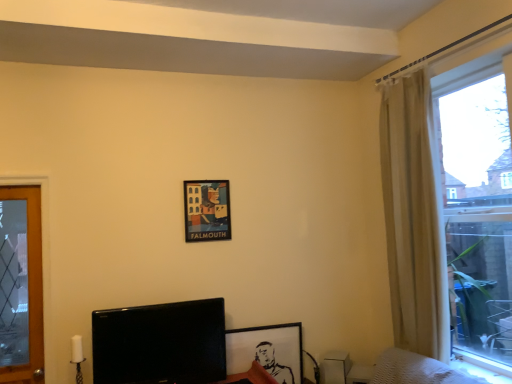
Question: Would you say black glossy tv at lower left is a long distance from beige fabric curtain at right?

Choices:
 (A) yes
 (B) no

Answer: (A)

Question: Does black glossy tv at lower left have a larger size compared to beige fabric curtain at right?

Choices:
 (A) yes
 (B) no

Answer: (B)

Question: Is black glossy tv at lower left next to beige fabric curtain at right?

Choices:
 (A) yes
 (B) no

Answer: (B)

Question: Does black glossy tv at lower left appear on the left side of beige fabric curtain at right?

Choices:
 (A) no
 (B) yes

Answer: (B)

Question: Is black glossy tv at lower left taller than beige fabric curtain at right?

Choices:
 (A) yes
 (B) no

Answer: (B)

Question: From a real-world perspective, is black glossy tv at lower left under beige fabric curtain at right?

Choices:
 (A) yes
 (B) no

Answer: (A)

Question: From a real-world perspective, is black matte picture frame at lower center, which is the second picture frame in left-to-right order, beneath translucent glass window at right?

Choices:
 (A) yes
 (B) no

Answer: (A)

Question: Is black matte picture frame at lower center, which is the second picture frame in left-to-right order, turned away from translucent glass window at right?

Choices:
 (A) no
 (B) yes

Answer: (A)

Question: Would you consider black matte picture frame at lower center, the first picture frame from the bottom, to be distant from translucent glass window at right?

Choices:
 (A) no
 (B) yes

Answer: (B)

Question: Is black matte picture frame at lower center, which appears as the second picture frame when viewed from the top, smaller than translucent glass window at right?

Choices:
 (A) yes
 (B) no

Answer: (A)

Question: Does black matte picture frame at lower center, the first picture frame in the right-to-left sequence, have a lesser height compared to translucent glass window at right?

Choices:
 (A) no
 (B) yes

Answer: (B)

Question: From a real-world perspective, does black matte picture frame at lower center, the first picture frame from the bottom, stand above translucent glass window at right?

Choices:
 (A) no
 (B) yes

Answer: (A)

Question: Considering the relative sizes of black glossy tv at lower left and matte paper poster at center, the first picture frame in the left-to-right sequence, in the image provided, is black glossy tv at lower left taller than matte paper poster at center, the first picture frame in the left-to-right sequence,?

Choices:
 (A) no
 (B) yes

Answer: (B)